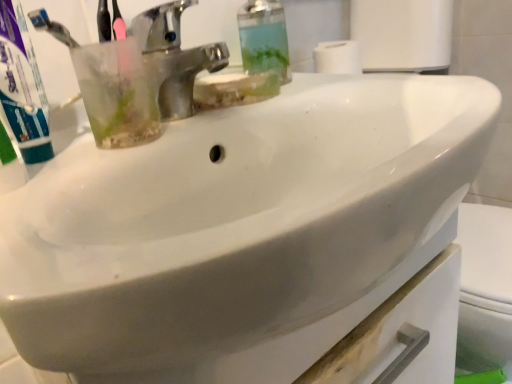
Question: Is transparent plastic soap dispenser at upper center positioned with its back to green matte toothpaste at left?

Choices:
 (A) yes
 (B) no

Answer: (B)

Question: Considering the relative positions of transparent plastic soap dispenser at upper center and green matte toothpaste at left in the image provided, is transparent plastic soap dispenser at upper center behind green matte toothpaste at left?

Choices:
 (A) no
 (B) yes

Answer: (B)

Question: Can you confirm if transparent plastic soap dispenser at upper center is taller than green matte toothpaste at left?

Choices:
 (A) yes
 (B) no

Answer: (A)

Question: Can you confirm if transparent plastic soap dispenser at upper center is positioned to the right of green matte toothpaste at left?

Choices:
 (A) no
 (B) yes

Answer: (B)

Question: Is transparent plastic soap dispenser at upper center closer to camera compared to green matte toothpaste at left?

Choices:
 (A) no
 (B) yes

Answer: (A)

Question: Is transparent plastic soap dispenser at upper center beside green matte toothpaste at left?

Choices:
 (A) no
 (B) yes

Answer: (A)

Question: Considering the relative positions of green matte toothpaste at left and polished chrome faucet at upper center in the image provided, is green matte toothpaste at left in front of polished chrome faucet at upper center?

Choices:
 (A) no
 (B) yes

Answer: (B)

Question: Can you confirm if green matte toothpaste at left is bigger than polished chrome faucet at upper center?

Choices:
 (A) yes
 (B) no

Answer: (B)

Question: Is polished chrome faucet at upper center inside green matte toothpaste at left?

Choices:
 (A) no
 (B) yes

Answer: (A)

Question: Does green matte toothpaste at left have a greater height compared to polished chrome faucet at upper center?

Choices:
 (A) yes
 (B) no

Answer: (A)

Question: From the image's perspective, is green matte toothpaste at left on polished chrome faucet at upper center?

Choices:
 (A) yes
 (B) no

Answer: (B)

Question: Can we say green matte toothpaste at left lies outside polished chrome faucet at upper center?

Choices:
 (A) no
 (B) yes

Answer: (B)

Question: From the image's perspective, does transparent plastic soap dispenser at upper center appear lower than polished chrome faucet at upper center?

Choices:
 (A) yes
 (B) no

Answer: (B)